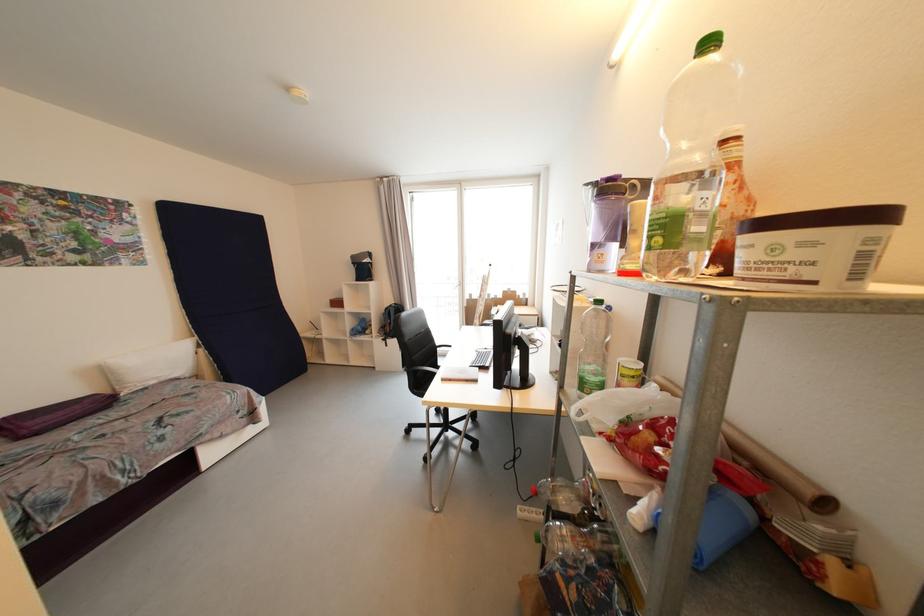
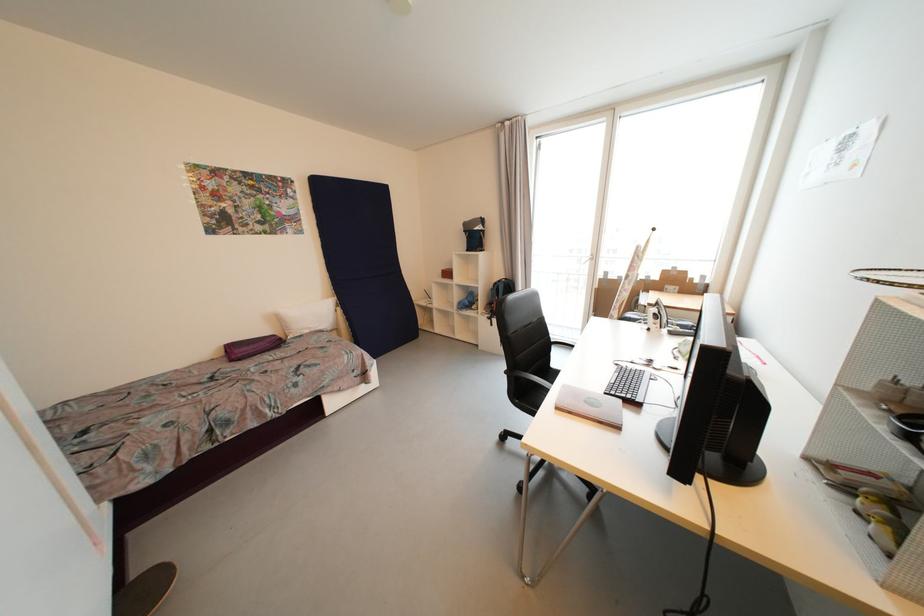
The point at (447, 382) is marked in the first image. Where is the corresponding point in the second image?

(562, 410)